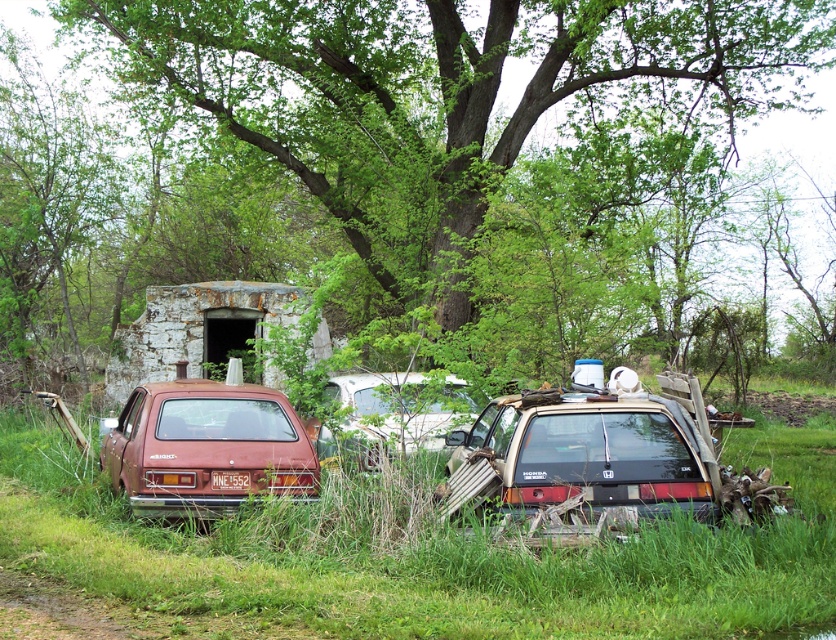
Can you confirm if green grass at center is bigger than rusty metal suv at center?

Correct, green grass at center is larger in size than rusty metal suv at center.

Does green grass at center lie behind rusty metal suv at center?

No, it is not.

Which is in front, point (503, 556) or point (573, 504)?

Point (503, 556) is in front.

You are a GUI agent. You are given a task and a screenshot of the screen. Output one action in this format:
    pyautogui.click(x=<x>, y=<y>)
    Task: Click on the green grass at center
    The height and width of the screenshot is (640, 836).
    Given the screenshot: What is the action you would take?
    pyautogui.click(x=422, y=554)

Who is lower down, green leafy tree at center or white matte car at center?

white matte car at center is lower down.

Is point (538, 35) positioned before point (375, 384)?

No, it is not.

This screenshot has width=836, height=640. What are the coordinates of `green leafy tree at center` in the screenshot? It's located at (467, 125).

Image resolution: width=836 pixels, height=640 pixels. I want to click on green leafy tree at center, so coord(467,125).

Looking at this image, how far apart are green leafy tree at center and rusty metal station wagon at lower left?

A distance of 8.92 meters exists between green leafy tree at center and rusty metal station wagon at lower left.

Who is higher up, green leafy tree at center or rusty metal station wagon at lower left?

Positioned higher is green leafy tree at center.

The image size is (836, 640). I want to click on green leafy tree at center, so click(467, 125).

In order to click on green leafy tree at center in this screenshot , I will do `click(467, 125)`.